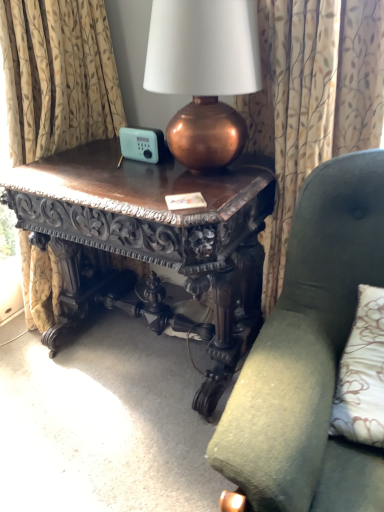
Question: Is green fabric chair at center to the left or to the right of polished dark wood table at center in the image?

Choices:
 (A) left
 (B) right

Answer: (B)

Question: Based on their sizes in the image, would you say green fabric chair at center is bigger or smaller than polished dark wood table at center?

Choices:
 (A) small
 (B) big

Answer: (A)

Question: Based on their relative distances, which object is nearer to the copper metallic lamp at upper center?

Choices:
 (A) polished dark wood table at center
 (B) patterned fabric curtain at upper center
 (C) green fabric chair at center

Answer: (B)

Question: Which object is the closest to the green fabric chair at center?

Choices:
 (A) patterned fabric curtain at upper center
 (B) polished dark wood table at center
 (C) copper metallic lamp at upper center

Answer: (A)